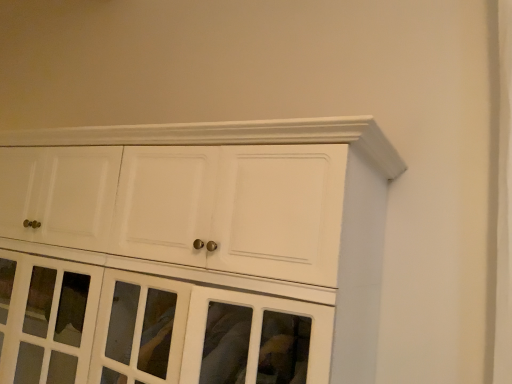
Describe the element at coordinates (343, 204) in the screenshot. This screenshot has width=512, height=384. I see `white matte cabinet at upper center` at that location.

Find the location of `white matte cabinet at upper center`. white matte cabinet at upper center is located at coordinates coord(343,204).

Where is `white matte cabinet at upper center`? Image resolution: width=512 pixels, height=384 pixels. white matte cabinet at upper center is located at coordinates (343, 204).